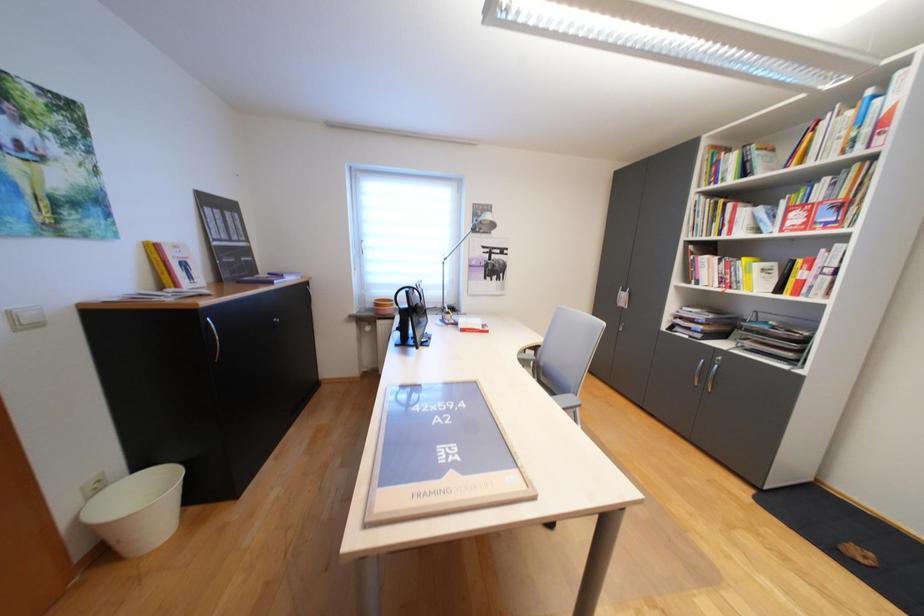
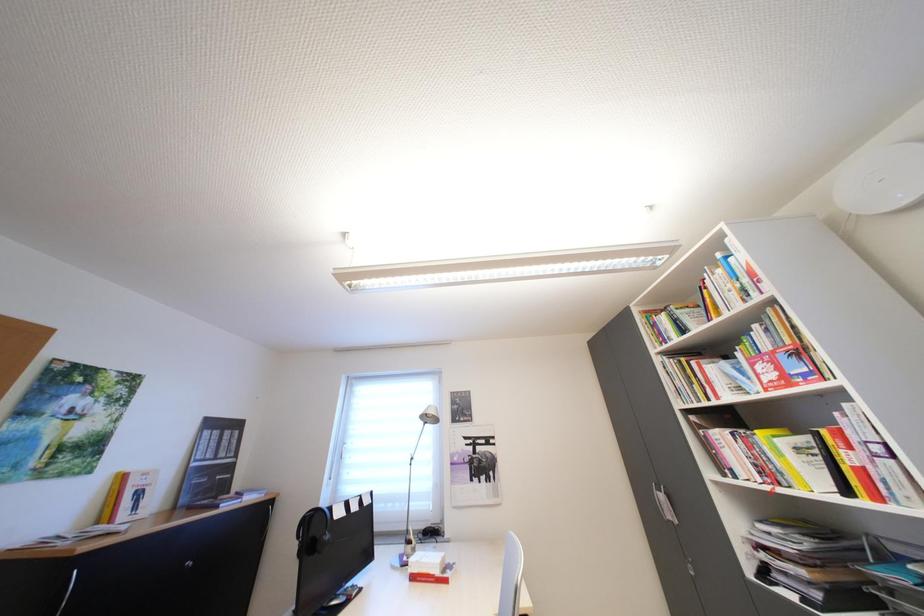
Question: The images are taken continuously from a first-person perspective. In which direction is your viewpoint rotating?

Choices:
 (A) Left
 (B) Right
 (C) Up
 (D) Down

Answer: (C)